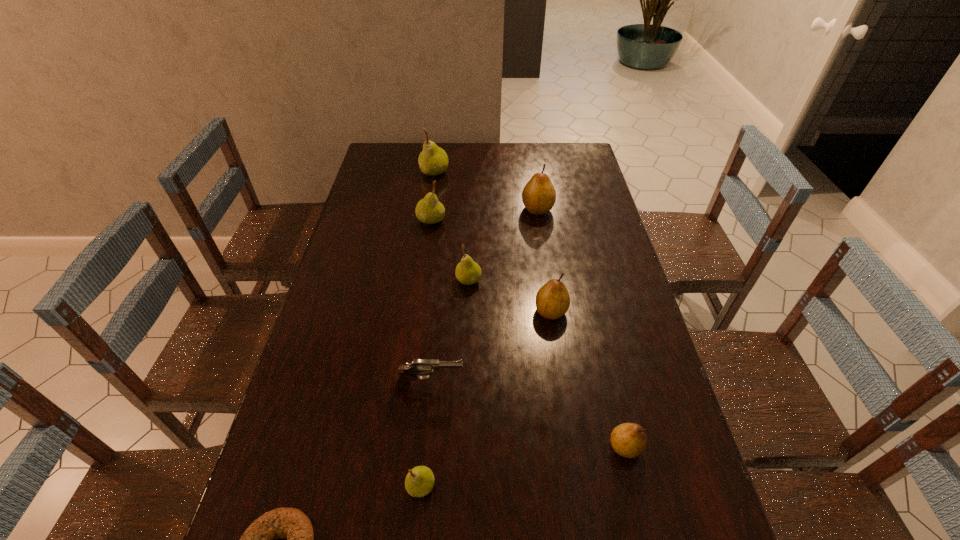
The image size is (960, 540). Find the location of `the biggest green pear`. the biggest green pear is located at coordinates (433, 160).

Identify the location of the farthest green pear. The height and width of the screenshot is (540, 960). [433, 160].

The image size is (960, 540). I want to click on the farthest brown pear, so click(539, 195).

I want to click on the second biggest green pear, so click(429, 210).

Where is `the third nearest pear`? Image resolution: width=960 pixels, height=540 pixels. the third nearest pear is located at coordinates (552, 300).

At what (x,y) coordinates should I click in order to perform the action: click on the second farthest brown pear. Please return your answer as a coordinate pair (x, y). Looking at the image, I should click on (552, 300).

You are a GUI agent. You are given a task and a screenshot of the screen. Output one action in this format:
    pyautogui.click(x=<x>, y=<y>)
    Task: Click on the fourth farthest object
    This screenshot has height=540, width=960.
    Given the screenshot: What is the action you would take?
    pyautogui.click(x=467, y=272)

Where is `the fourth nearest pear`? The image size is (960, 540). the fourth nearest pear is located at coordinates (467, 272).

What are the coordinates of `pistol` in the screenshot? It's located at (402, 380).

This screenshot has width=960, height=540. I want to click on gray pistol, so click(x=402, y=380).